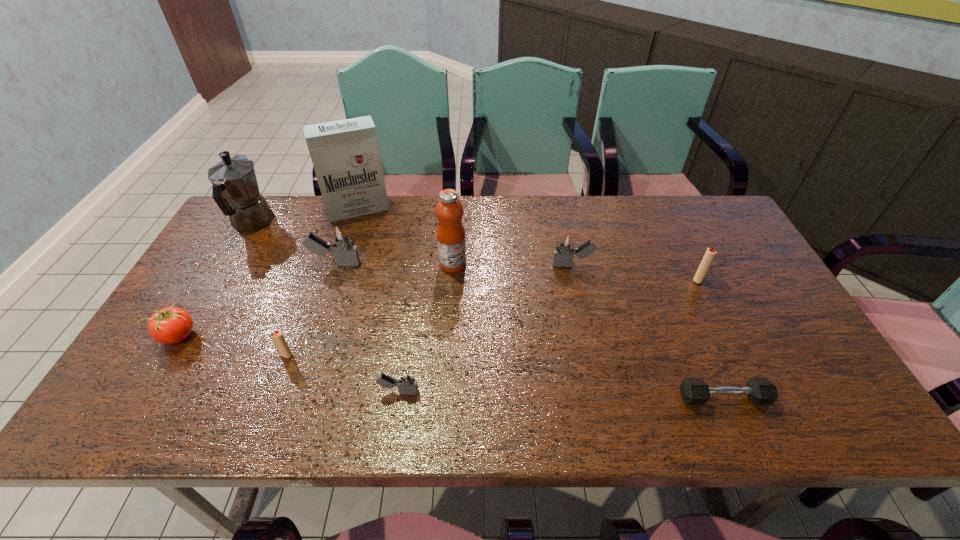
What are the coordinates of `tomato present at the left edge` in the screenshot? It's located at point(171,325).

The width and height of the screenshot is (960, 540). In order to click on object present at the far left corner in this screenshot , I will do `click(235, 189)`.

The width and height of the screenshot is (960, 540). In the image, there is a desktop. In order to click on vacant space at the far edge in this screenshot , I will do `click(471, 214)`.

What are the coordinates of `vacant space at the near edge of the desktop` in the screenshot? It's located at (762, 418).

I want to click on vacant space at the left edge, so click(x=201, y=344).

Locate an element on the screen. This screenshot has width=960, height=540. free space at the far right corner of the desktop is located at coordinates (694, 233).

At what (x,y) coordinates should I click in order to perform the action: click on vacant space at the near right corner of the desktop. Please return your answer as a coordinate pair (x, y). The height and width of the screenshot is (540, 960). Looking at the image, I should click on (792, 400).

Where is `unoccupied position between the bigger red igniter and the dumbbell`? unoccupied position between the bigger red igniter and the dumbbell is located at coordinates (710, 339).

The image size is (960, 540). In order to click on free space between the tomato and the coffeepot in this screenshot , I will do `click(215, 280)`.

Identify the location of vacant area between the dumbbell and the second nearest igniter. (505, 376).